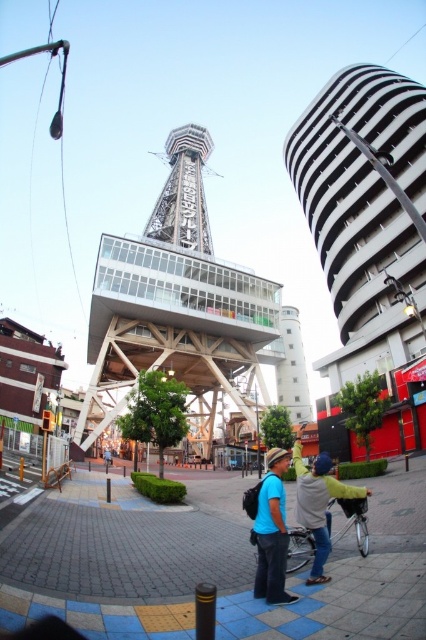
You are a delivery person who needs to choose between the silver metallic bicycle at center and the blue matte bicycle at center to deliver packages in the city. Which bicycle should you choose if you need to carry more items?

The silver metallic bicycle at center has a larger size compared to the blue matte bicycle at center, so it can carry more items.

You are a city planner reviewing this urban design. The city has a regulation that no structure can be built directly above another. Based on the scene, does the placement of the glassy steel tower at center and metallic silver tower at center comply with this regulation?

The glassy steel tower at center is positioned under the metallic silver tower at center, which means they are stacked vertically. This violates the city regulation that prohibits structures from being built directly above another. Therefore, the placement does not comply with the regulation.

You are standing at the bottom left of the image where the two individuals are located. You want to place a new bench so that it is exactly halfway between your current position and the blue fabric backpack at center. What are the coordinates of the point where the bench should be placed?

The coordinates of the blue fabric backpack at center are given as point [271,531]. To find the halfway point between your current position at the bottom left corner and the backpack, you would calculate the midpoint between these two points. Assuming the bottom left corner is at coordinates [0,0], the midpoint would be at [135,265]. Therefore, the bench should be placed at approximately [135,266].